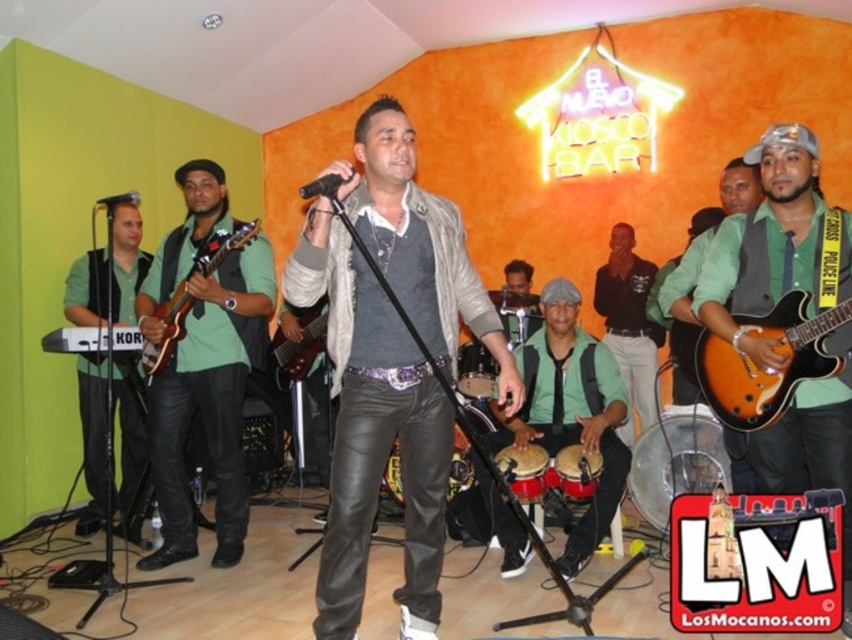
Is green matte vest at left shorter than matte brown guitar at center?

No.

Does point (96, 301) lie behind point (278, 339)?

That is False.

I want to click on green matte vest at left, so click(105, 433).

Does matte brown electric guitar at center-left come in front of black matte microphone at center?

No.

Measure the distance between matte brown electric guitar at center-left and camera.

matte brown electric guitar at center-left is 3.44 meters away from camera.

At what (x,y) coordinates should I click in order to perform the action: click on matte brown electric guitar at center-left. Please return your answer as a coordinate pair (x, y). Looking at the image, I should click on (188, 294).

Which of these two, leather pants at center or matte orange electric guitar at center, stands shorter?

With less height is matte orange electric guitar at center.

Does point (418, 358) lie behind point (815, 292)?

No, it is in front of (815, 292).

What are the coordinates of `leather pants at center` in the screenshot? It's located at (373, 433).

Find the location of `leather pants at center`. leather pants at center is located at coordinates (373, 433).